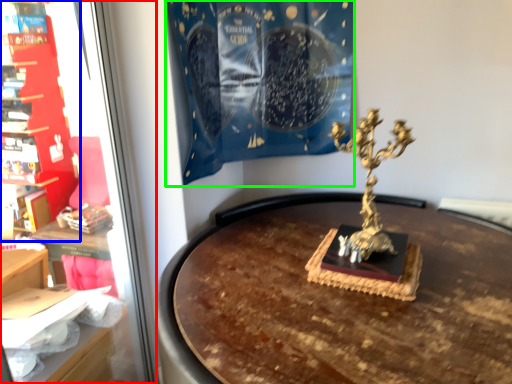
Question: Considering the real-world distances, which object is closest to shop window (highlighted by a red box)? furniture (highlighted by a blue box) or curtain (highlighted by a green box).

Choices:
 (A) furniture
 (B) curtain

Answer: (A)